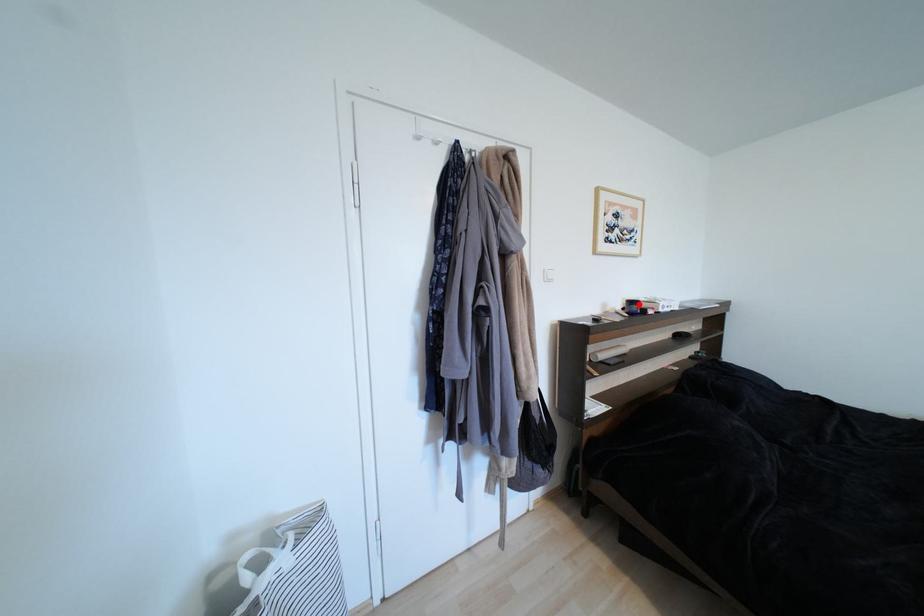
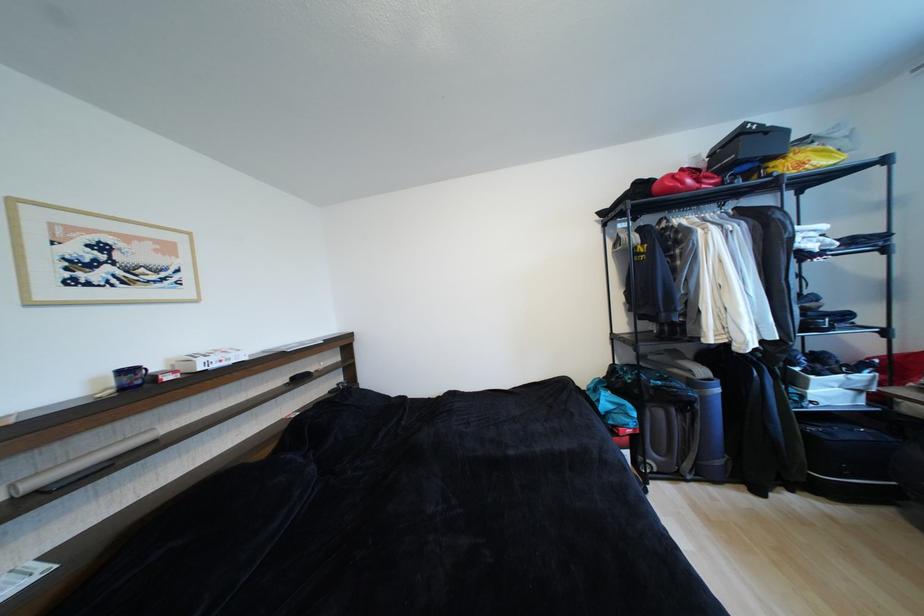
Where in the second image is the point corresponding to the highlighted location from the first image?

(134, 373)